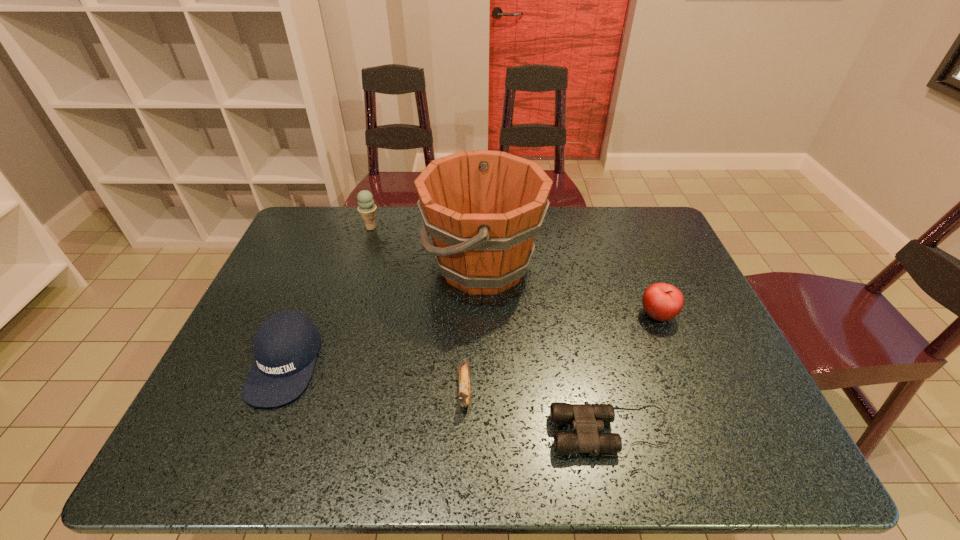
At what (x,y) coordinates should I click in order to perform the action: click on vacant space situated 0.320m on the front of the apple. Please return your answer as a coordinate pair (x, y). Image resolution: width=960 pixels, height=540 pixels. Looking at the image, I should click on (711, 447).

Identify the location of free space located on the front-facing side of the baseball cap. (247, 458).

The width and height of the screenshot is (960, 540). I want to click on vacant space located at the stem of the second shortest object, so click(x=463, y=462).

Identify the location of free space located 0.360m at the eyepiece of the binoculars. This screenshot has height=540, width=960. (381, 430).

This screenshot has height=540, width=960. Identify the location of vacant space located at the eyepiece of the binoculars. (475, 430).

I want to click on free space located 0.320m at the eyepiece of the binoculars, so click(x=399, y=430).

The image size is (960, 540). I want to click on bucket present at the far edge, so pos(482,209).

At what (x,y) coordinates should I click in order to perform the action: click on ice cream that is at the far edge. Please return your answer as a coordinate pair (x, y). Looking at the image, I should click on (367, 209).

Identify the location of object that is positioned at the near edge. (587, 419).

Where is `object positioned at the left edge`? object positioned at the left edge is located at coordinates (285, 346).